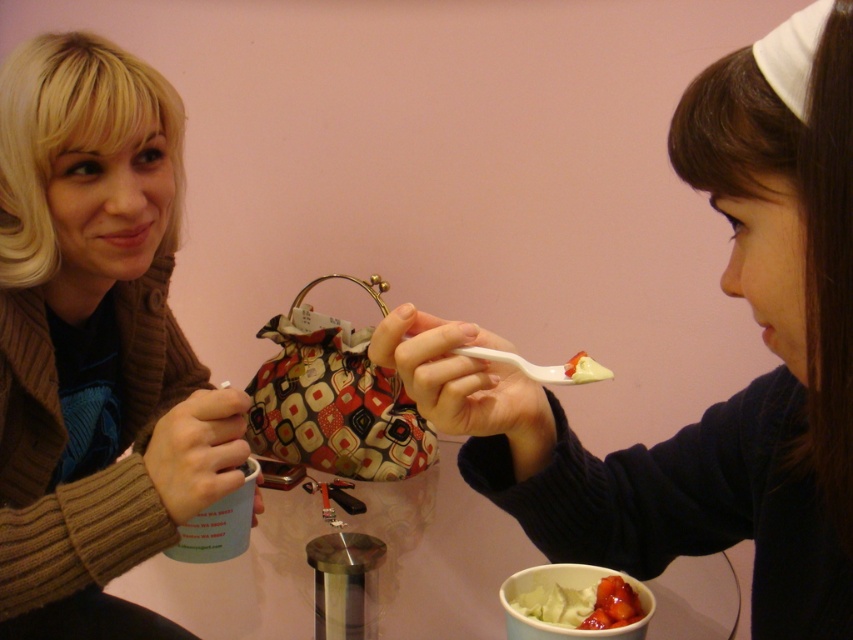
Question: Is white matte spoon at upper center thinner than white creamy dessert at lower center?

Choices:
 (A) yes
 (B) no

Answer: (B)

Question: Does matte brown sweater at left have a greater width compared to white creamy dessert at lower center?

Choices:
 (A) yes
 (B) no

Answer: (A)

Question: Which of these objects is positioned closest to the white matte spoon at upper center?

Choices:
 (A) matte brown sweater at left
 (B) white creamy dessert at lower center

Answer: (B)

Question: Which of the following is the farthest from the observer?

Choices:
 (A) (556, 618)
 (B) (120, 538)

Answer: (B)

Question: Is white matte spoon at upper center in front of white creamy dessert at lower center?

Choices:
 (A) yes
 (B) no

Answer: (A)

Question: Based on their relative distances, which object is farther from the white creamy dessert at lower center?

Choices:
 (A) matte brown sweater at left
 (B) white matte spoon at upper center

Answer: (A)